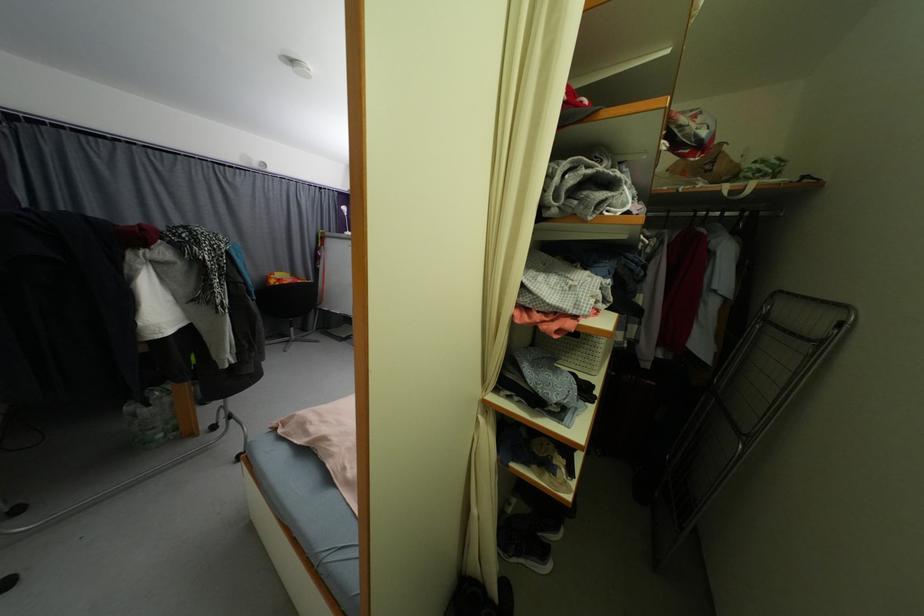
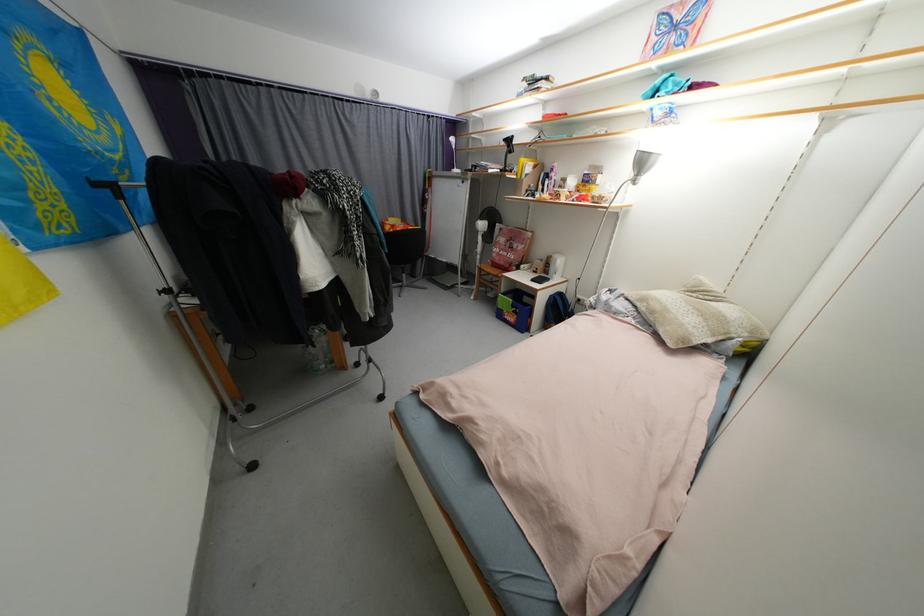
Question: How did the camera likely rotate?

Choices:
 (A) Left
 (B) Right
 (C) Up
 (D) Down

Answer: (A)